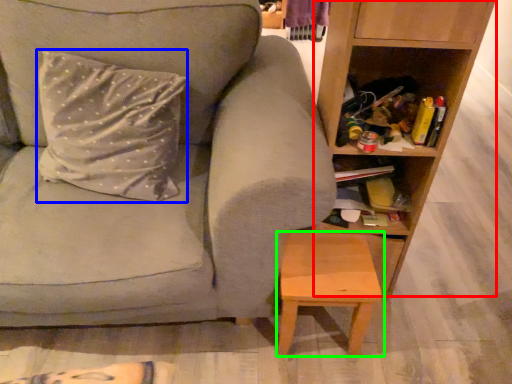
Question: Estimate the real-world distances between objects in this image. Which object is farther from shelf (highlighted by a red box), pillow (highlighted by a blue box) or stool (highlighted by a green box)?

Choices:
 (A) pillow
 (B) stool

Answer: (A)